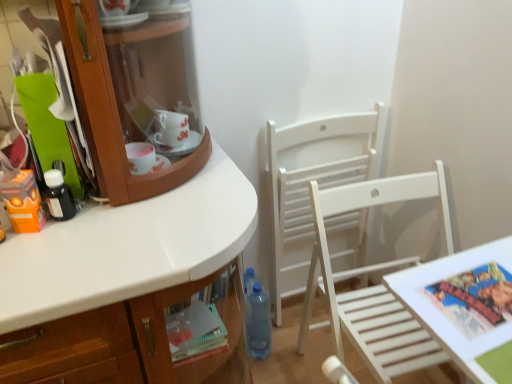
Describe the element at coordinates (474, 299) in the screenshot. I see `printed paper comic book at lower right` at that location.

In order to click on white wood chair at center, which is counted as the second chair, starting from the front in this screenshot , I will do `click(318, 184)`.

The image size is (512, 384). What do you see at coordinates (59, 196) in the screenshot?
I see `black matte bottle at left, marked as the second bottle in a bottom-to-top arrangement` at bounding box center [59, 196].

You are a GUI agent. You are given a task and a screenshot of the screen. Output one action in this format:
    pyautogui.click(x=<x>, y=<y>)
    Task: Click on the blue translucent bottle at lower center, which ranks as the first bottle in bottom-to-top order
    This screenshot has width=512, height=384.
    Given the screenshot: What is the action you would take?
    click(258, 322)

Could you tell me if white wood chair at center, acting as the 1th chair starting from the front, is turned towards white wooden table at lower right?

Yes, white wood chair at center, acting as the 1th chair starting from the front, faces towards white wooden table at lower right.

Does white wood chair at center, the second chair in the back-to-front sequence, have a lesser width compared to white wooden table at lower right?

No, white wood chair at center, the second chair in the back-to-front sequence, is not thinner than white wooden table at lower right.

Is the depth of white wood chair at center, acting as the 1th chair starting from the front, greater than that of white wooden table at lower right?

Yes, the depth of white wood chair at center, acting as the 1th chair starting from the front, is greater than that of white wooden table at lower right.

From the image's perspective, which is above, blue translucent bottle at lower center, which ranks as the first bottle in bottom-to-top order, or printed paper comic book at lower right?

printed paper comic book at lower right, from the image's perspective.

Does blue translucent bottle at lower center, the first bottle from the right, have a greater height compared to printed paper comic book at lower right?

Indeed, blue translucent bottle at lower center, the first bottle from the right, has a greater height compared to printed paper comic book at lower right.

In the scene shown: Is blue translucent bottle at lower center, the first bottle from the right, spatially inside printed paper comic book at lower right, or outside of it?

blue translucent bottle at lower center, the first bottle from the right, cannot be found inside printed paper comic book at lower right.

In the scene shown: Is the surface of blue translucent bottle at lower center, arranged as the first bottle when viewed from the back, in direct contact with printed paper comic book at lower right?

No, blue translucent bottle at lower center, arranged as the first bottle when viewed from the back, is not with printed paper comic book at lower right.

Does point (409, 306) come farther from viewer compared to point (262, 289)?

No, (409, 306) is closer to viewer.

From a real-world perspective, which is physically above, white wooden table at lower right or blue translucent bottle at lower center, the 2th bottle viewed from the front?

white wooden table at lower right.

Looking at their sizes, would you say white wooden table at lower right is wider or thinner than blue translucent bottle at lower center, the 2th bottle viewed from the front?

Clearly, white wooden table at lower right has more width compared to blue translucent bottle at lower center, the 2th bottle viewed from the front.

Find the location of a particular element. This screenshot has width=512, height=384. bottle below the white wooden table at lower right (from the image's perspective) is located at coordinates (258, 322).

Is white wood chair at center, which is counted as the second chair, starting from the front, placed right next to blue translucent bottle at lower center, the first bottle from the right?

They are not placed beside each other.

From a real-world perspective, between white wood chair at center, which is counted as the second chair, starting from the front, and blue translucent bottle at lower center, the 2th bottle viewed from the front, who is vertically lower?

In real-world perspective, blue translucent bottle at lower center, the 2th bottle viewed from the front, is lower.

Consider the image. Between white wood chair at center, which is counted as the second chair, starting from the front, and blue translucent bottle at lower center, the 2th bottle from the top, which one appears on the left side from the viewer's perspective?

Positioned to the left is blue translucent bottle at lower center, the 2th bottle from the top.

Consider the image. What's the angular difference between white wood chair at center, which is counted as the second chair, starting from the front, and blue translucent bottle at lower center, the 2th bottle from the top,'s facing directions?

white wood chair at center, which is counted as the second chair, starting from the front, and blue translucent bottle at lower center, the 2th bottle from the top, are facing 0.0904 degrees away from each other.

Identify the location of the 2nd bottle behind the printed paper comic book at lower right, counting from the anchor's position. The image size is (512, 384). (258, 322).

Between printed paper comic book at lower right and blue translucent bottle at lower center, the 2th bottle viewed from the front, which one is positioned behind?

blue translucent bottle at lower center, the 2th bottle viewed from the front, is more distant.

Can you confirm if printed paper comic book at lower right is thinner than blue translucent bottle at lower center, which appears as the second bottle when viewed from the left?

Incorrect, the width of printed paper comic book at lower right is not less than that of blue translucent bottle at lower center, which appears as the second bottle when viewed from the left.

From the picture: Is printed paper comic book at lower right facing towards blue translucent bottle at lower center, which ranks as the first bottle in bottom-to-top order?

No, printed paper comic book at lower right does not turn towards blue translucent bottle at lower center, which ranks as the first bottle in bottom-to-top order.

Would you consider white wood chair at center, which is the 1th chair from back to front, to be distant from orange matte toy at left?

No, white wood chair at center, which is the 1th chair from back to front, is not far from orange matte toy at left.

From the picture: Is the depth of white wood chair at center, which is the 1th chair from back to front, less than that of orange matte toy at left?

No.

Is white wood chair at center, which is the 1th chair from back to front, positioned beyond the bounds of orange matte toy at left?

Indeed, white wood chair at center, which is the 1th chair from back to front, is completely outside orange matte toy at left.

From a real-world perspective, is white wood chair at center, which is the 1th chair from back to front, under orange matte toy at left?

Yes.

From a real-world perspective, is white wood chair at center, the second chair in the back-to-front sequence, above or below printed paper comic book at lower right?

white wood chair at center, the second chair in the back-to-front sequence, is below printed paper comic book at lower right.

Could you tell me if white wood chair at center, acting as the 1th chair starting from the front, is facing printed paper comic book at lower right?

Yes, white wood chair at center, acting as the 1th chair starting from the front, is aimed at printed paper comic book at lower right.

From the image's perspective, is white wood chair at center, the second chair in the back-to-front sequence, on top of printed paper comic book at lower right?

No, from the image's perspective, white wood chair at center, the second chair in the back-to-front sequence, is not on top of printed paper comic book at lower right.

Locate an element on the screen. Image resolution: width=512 pixels, height=384 pixels. the 1st chair to the left of the printed paper comic book at lower right, starting your count from the anchor is located at coordinates (373, 286).

Where is `table located above the white wood chair at center, acting as the 1th chair starting from the front (from the image's perspective)`? The image size is (512, 384). table located above the white wood chair at center, acting as the 1th chair starting from the front (from the image's perspective) is located at coordinates (463, 304).

Locate an element on the screen. This screenshot has height=384, width=512. the 2nd bottle behind the printed paper comic book at lower right is located at coordinates pos(258,322).

Looking at the image, which one is located closer to white wood chair at center, which is the 1th chair from back to front, orange matte toy at left or printed paper comic book at lower right?

Among the two, printed paper comic book at lower right is located nearer to white wood chair at center, which is the 1th chair from back to front.

Estimate the real-world distances between objects in this image. Which object is further from white wood chair at center, which is counted as the second chair, starting from the front, orange matte toy at left or white wooden table at lower right?

Among the two, orange matte toy at left is located further to white wood chair at center, which is counted as the second chair, starting from the front.

From the picture: From the image, which object appears to be farther from printed paper comic book at lower right, white wood chair at center, which is the 1th chair from back to front, or blue translucent bottle at lower center, the 2th bottle viewed from the front?

blue translucent bottle at lower center, the 2th bottle viewed from the front, is positioned further to the anchor printed paper comic book at lower right.

Which object lies further to the anchor point printed paper comic book at lower right, white wooden table at lower right or orange matte toy at left?

orange matte toy at left.

Estimate the real-world distances between objects in this image. Which object is further from blue translucent bottle at lower center, arranged as the first bottle when viewed from the back, printed paper comic book at lower right or black matte bottle at left, marked as the second bottle in a bottom-to-top arrangement?

black matte bottle at left, marked as the second bottle in a bottom-to-top arrangement.

Considering their positions, is white wooden table at lower right positioned further to blue translucent bottle at lower center, which appears as the second bottle when viewed from the left, than white wood chair at center, which is the 1th chair from back to front?

white wooden table at lower right is positioned further to the anchor blue translucent bottle at lower center, which appears as the second bottle when viewed from the left.

From the image, which object appears to be nearer to white wooden table at lower right, orange matte toy at left or black matte bottle at left, marked as the second bottle in a bottom-to-top arrangement?

black matte bottle at left, marked as the second bottle in a bottom-to-top arrangement, lies closer to white wooden table at lower right than the other object.

When comparing their distances from blue translucent bottle at lower center, arranged as the first bottle when viewed from the back, does black matte bottle at left, marked as the second bottle in a right-to-left arrangement, or printed paper comic book at lower right seem closer?

printed paper comic book at lower right is closer to blue translucent bottle at lower center, arranged as the first bottle when viewed from the back.

The height and width of the screenshot is (384, 512). I want to click on table between printed paper comic book at lower right and white wood chair at center, the second chair in the back-to-front sequence, from front to back, so click(463, 304).

Image resolution: width=512 pixels, height=384 pixels. In order to click on bottle situated between black matte bottle at left, the 1th bottle when ordered from top to bottom, and white wooden table at lower right from left to right in this screenshot , I will do `click(258, 322)`.

What are the coordinates of `table between printed paper comic book at lower right and blue translucent bottle at lower center, arranged as the first bottle when viewed from the back, in the front-back direction` in the screenshot? It's located at (463, 304).

Find the location of a particular element. The height and width of the screenshot is (384, 512). bottle between black matte bottle at left, marked as the second bottle in a bottom-to-top arrangement, and white wood chair at center, which is counted as the second chair, starting from the front, from left to right is located at coordinates (258, 322).